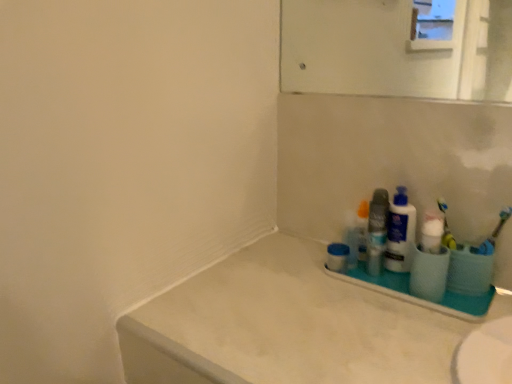
This screenshot has height=384, width=512. Find the location of `free point above white plastic tray at lower right (from a real-world perspective)`. free point above white plastic tray at lower right (from a real-world perspective) is located at coordinates (407, 270).